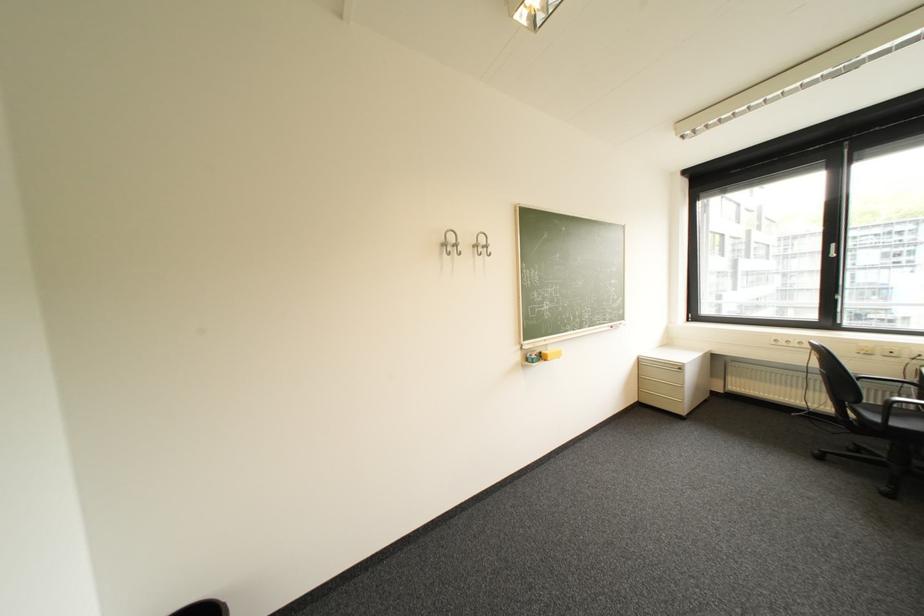
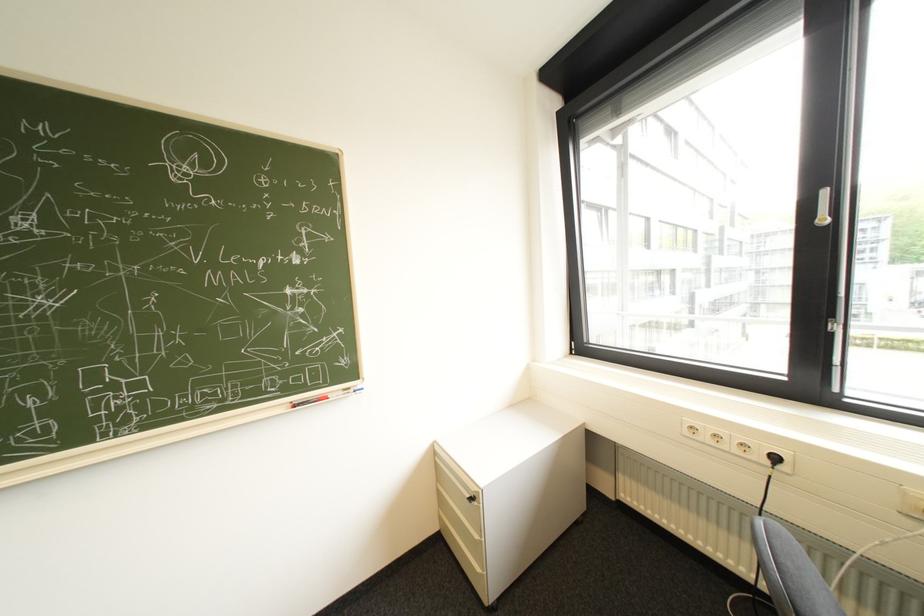
The point at (x=793, y=344) is marked in the first image. Where is the corresponding point in the second image?

(715, 438)